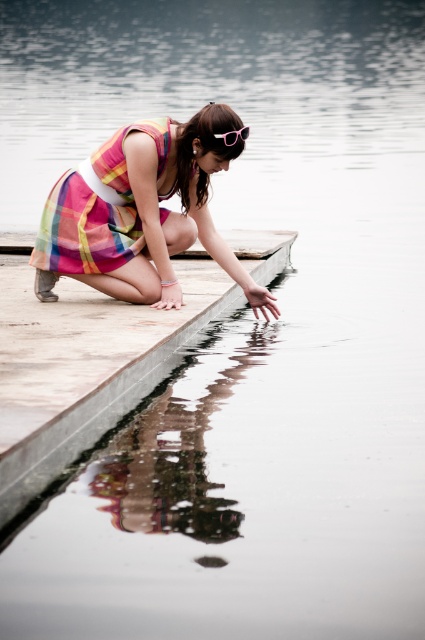
Question: Which object appears farthest from the camera in this image?

Choices:
 (A) concrete dock at center
 (B) pink plastic goggles at center
 (C) plaid fabric dress at center

Answer: (C)

Question: Which of the following is the farthest from the observer?

Choices:
 (A) pink plastic goggles at center
 (B) plaid fabric dress at center
 (C) concrete dock at center

Answer: (B)

Question: Does concrete dock at center have a greater width compared to plaid fabric dress at center?

Choices:
 (A) yes
 (B) no

Answer: (B)

Question: Can you confirm if concrete dock at center is wider than pink plastic goggles at center?

Choices:
 (A) no
 (B) yes

Answer: (B)

Question: Is concrete dock at center to the left of plaid fabric dress at center from the viewer's perspective?

Choices:
 (A) yes
 (B) no

Answer: (A)

Question: Considering the real-world distances, which object is farthest from the pink plastic goggles at center?

Choices:
 (A) plaid fabric dress at center
 (B) concrete dock at center

Answer: (B)